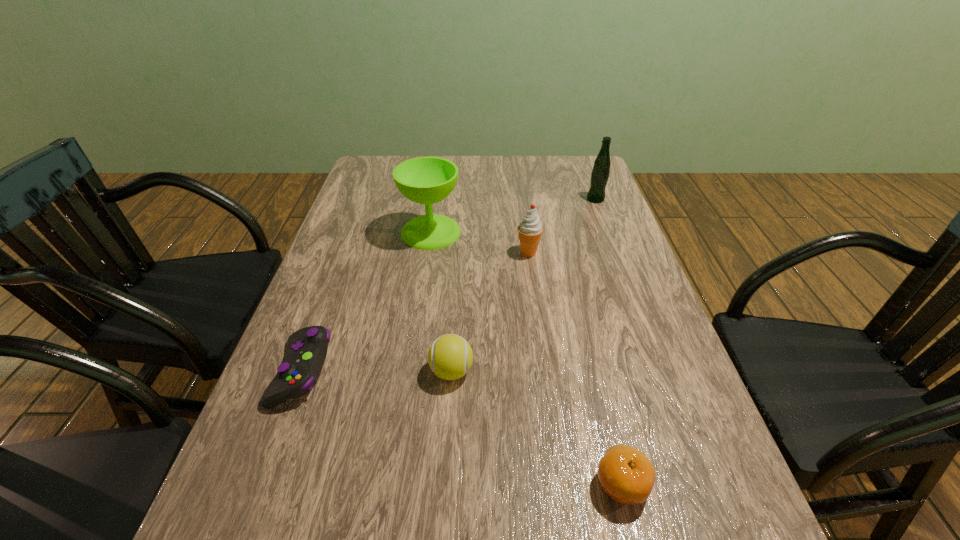
Image resolution: width=960 pixels, height=540 pixels. I want to click on beer bottle, so click(x=600, y=173).

This screenshot has height=540, width=960. In order to click on the rightmost object in this screenshot , I will do coord(600,173).

The width and height of the screenshot is (960, 540). I want to click on wineglass, so click(425, 180).

Locate an element on the screen. icecream is located at coordinates (530, 229).

This screenshot has height=540, width=960. I want to click on the fourth shortest object, so click(530, 229).

This screenshot has width=960, height=540. Find the location of `the third shortest object`. the third shortest object is located at coordinates (450, 356).

Where is `the nearest object`? the nearest object is located at coordinates (624, 473).

You are a GUI agent. You are given a task and a screenshot of the screen. Output one action in this format:
    pyautogui.click(x=<x>, y=<y>)
    Task: Click on the clementine
    
    Given the screenshot: What is the action you would take?
    pyautogui.click(x=624, y=473)

The width and height of the screenshot is (960, 540). Identify the location of control. (302, 365).

I want to click on vacant space located 0.350m on the left of the rightmost object, so click(x=478, y=199).